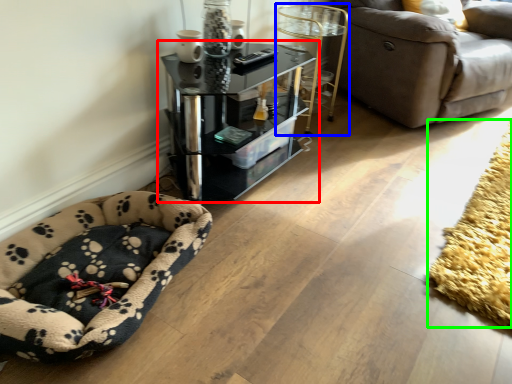
Question: Which object is the closest to the table (highlighted by a red box)? Choose among these: side table (highlighted by a blue box) or mat (highlighted by a green box).

Choices:
 (A) side table
 (B) mat

Answer: (A)